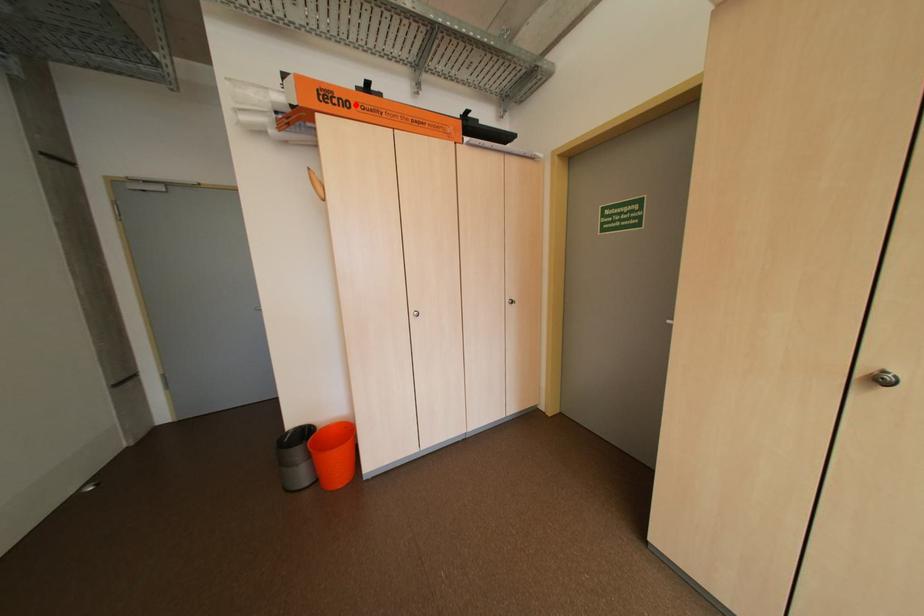
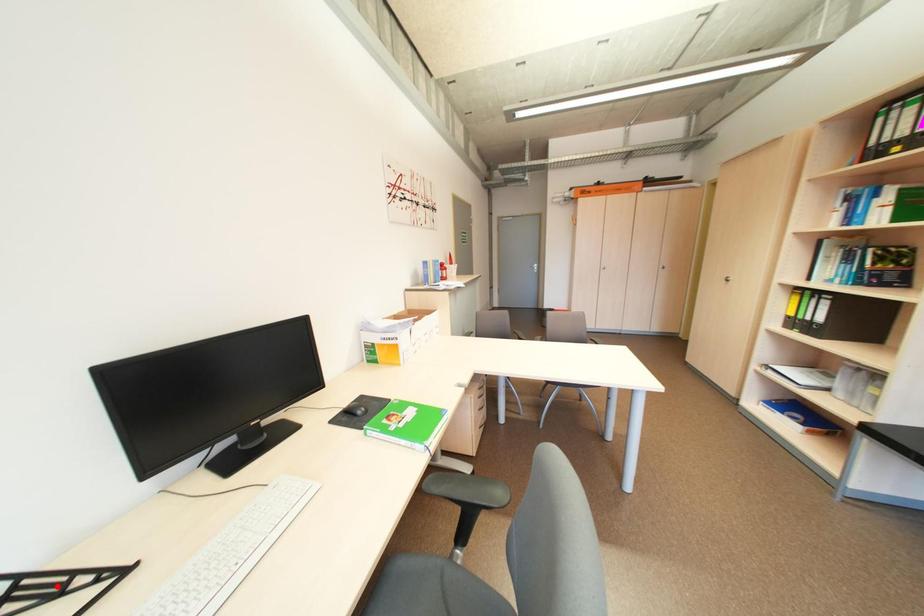
I am providing you with two images of the same scene from different viewpoints. A red point is marked on the first image and another point is marked on the second image. Does the point marked in image1 correspond to the same location as the one in image2?

No